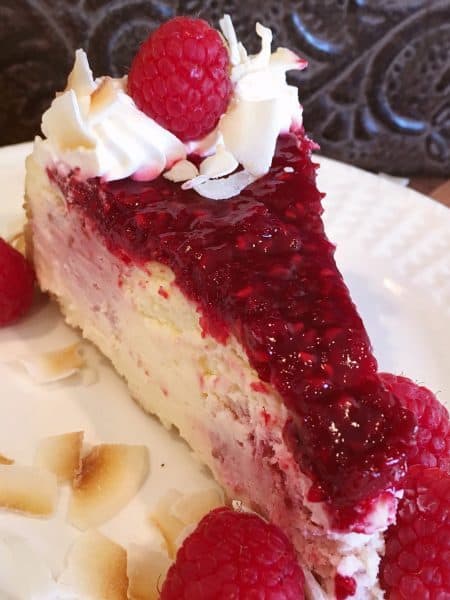
Locate an element on the screen. plate is located at coordinates [394, 257].